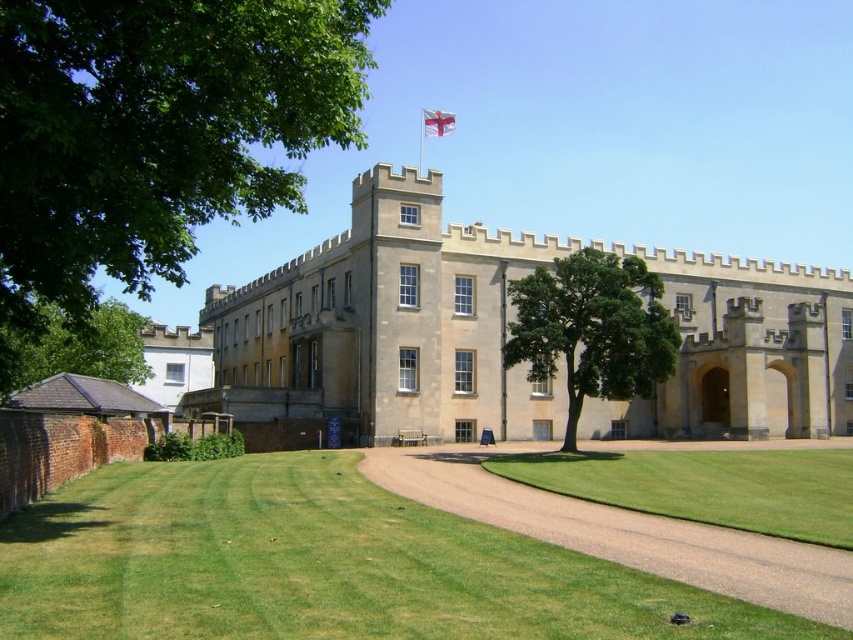
Question: Is beige stone castle at center to the right of green leafy tree at center from the viewer's perspective?

Choices:
 (A) no
 (B) yes

Answer: (A)

Question: Which is nearer to the green grass at center?

Choices:
 (A) beige stone castle at center
 (B) green leafy tree at upper left
 (C) green leafy tree at center

Answer: (C)

Question: Can you confirm if beige stone castle at center is positioned below green grass at center?

Choices:
 (A) no
 (B) yes

Answer: (A)

Question: Which point is closer to the camera?

Choices:
 (A) green leafy tree at upper left
 (B) beige stone castle at center
 (C) green grass at center

Answer: (A)

Question: Which is nearer to the green leafy tree at center?

Choices:
 (A) beige stone castle at center
 (B) green leafy tree at lower left
 (C) green grass at lower left
 (D) green leafy tree at upper left

Answer: (A)

Question: Is beige stone castle at center further to the viewer compared to green leafy tree at center?

Choices:
 (A) no
 (B) yes

Answer: (B)